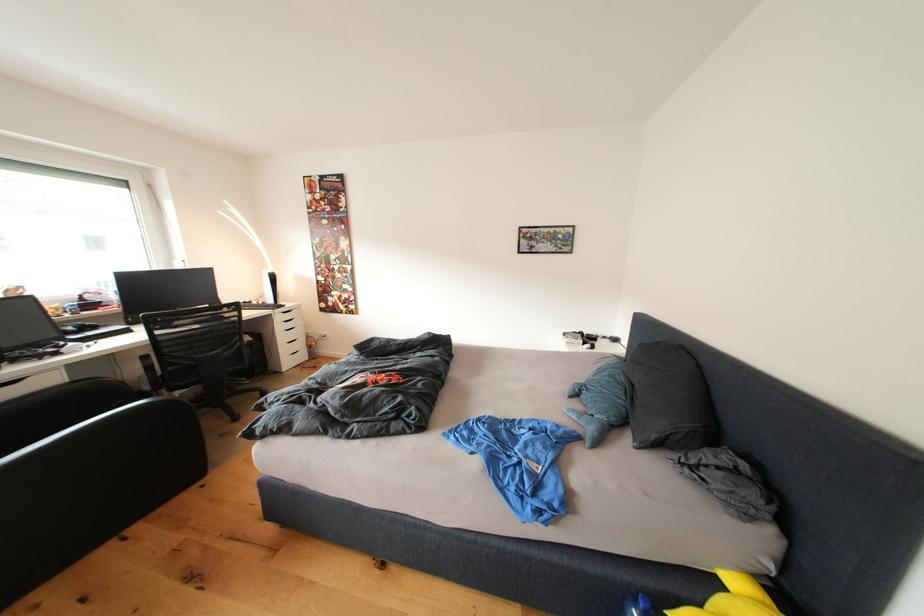
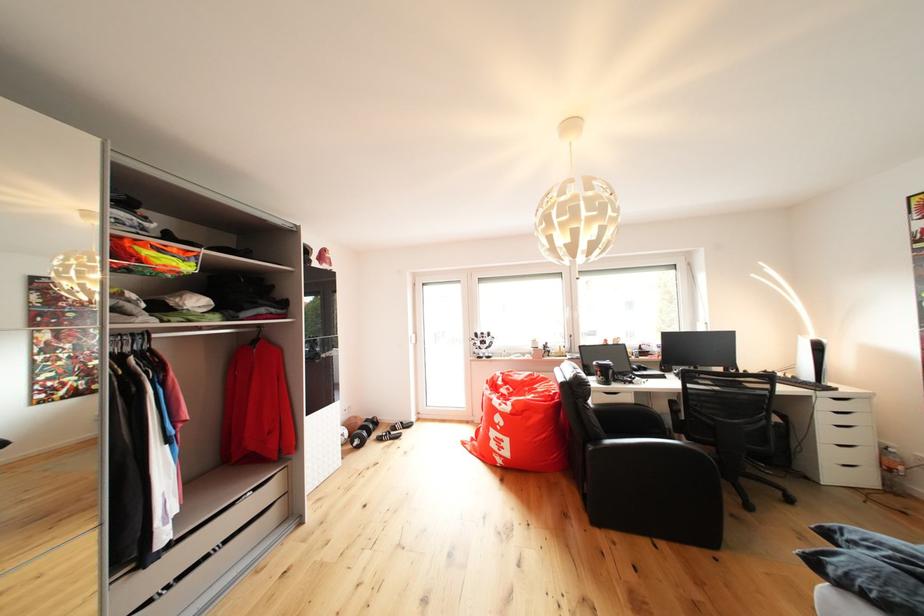
Find the pixel in the second image that matches point (297, 322) in the first image.

(850, 411)